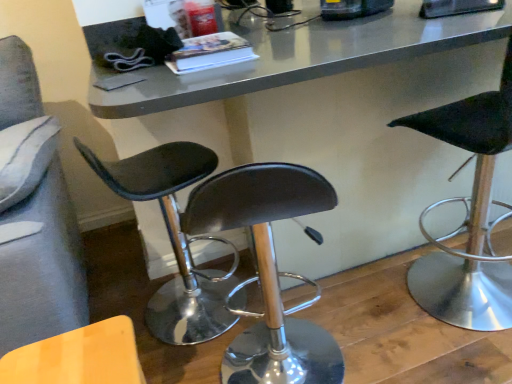
Question: Could you tell me if black leather stool at right, the third chair from the left, is turned towards black leather stool at center, which ranks as the 2th chair in right-to-left order?

Choices:
 (A) no
 (B) yes

Answer: (A)

Question: Is black leather stool at right, the 1th chair viewed from the right, touching black leather stool at center, which ranks as the 2th chair in right-to-left order?

Choices:
 (A) yes
 (B) no

Answer: (B)

Question: Is black leather stool at center, positioned as the second chair in left-to-right order, at the back of black leather stool at right, the 1th chair viewed from the right?

Choices:
 (A) yes
 (B) no

Answer: (B)

Question: Does black leather stool at right, the third chair from the left, have a greater height compared to black leather stool at center, which ranks as the 2th chair in right-to-left order?

Choices:
 (A) yes
 (B) no

Answer: (A)

Question: Is black leather stool at right, the 1th chair viewed from the right, thinner than black leather stool at center, which ranks as the 2th chair in right-to-left order?

Choices:
 (A) no
 (B) yes

Answer: (B)

Question: Is the position of black leather stool at right, the third chair from the left, more distant than that of black leather stool at center, positioned as the second chair in left-to-right order?

Choices:
 (A) yes
 (B) no

Answer: (B)

Question: From a real-world perspective, is wooden textured chair at lower left, the first chair positioned from the left, below metallic gray table at center?

Choices:
 (A) no
 (B) yes

Answer: (B)

Question: Is wooden textured chair at lower left, the first chair positioned from the left, facing away from metallic gray table at center?

Choices:
 (A) yes
 (B) no

Answer: (B)

Question: From a real-world perspective, is wooden textured chair at lower left, the 3th chair when ordered from right to left, located higher than metallic gray table at center?

Choices:
 (A) no
 (B) yes

Answer: (A)

Question: Is wooden textured chair at lower left, the first chair positioned from the left, taller than metallic gray table at center?

Choices:
 (A) no
 (B) yes

Answer: (A)

Question: Is wooden textured chair at lower left, the first chair positioned from the left, to the left of metallic gray table at center from the viewer's perspective?

Choices:
 (A) no
 (B) yes

Answer: (B)

Question: From the image's perspective, does wooden textured chair at lower left, the first chair positioned from the left, appear lower than metallic gray table at center?

Choices:
 (A) yes
 (B) no

Answer: (A)

Question: Is the depth of black leather stool at right, the 1th chair viewed from the right, less than that of metallic gray table at center?

Choices:
 (A) no
 (B) yes

Answer: (B)